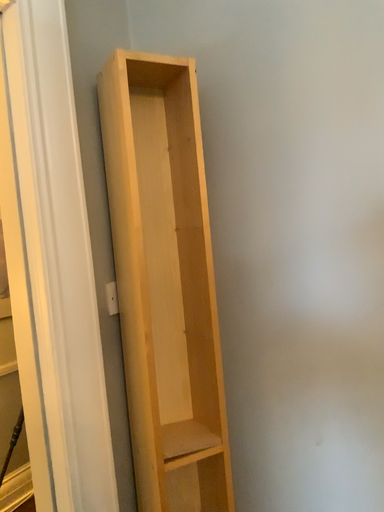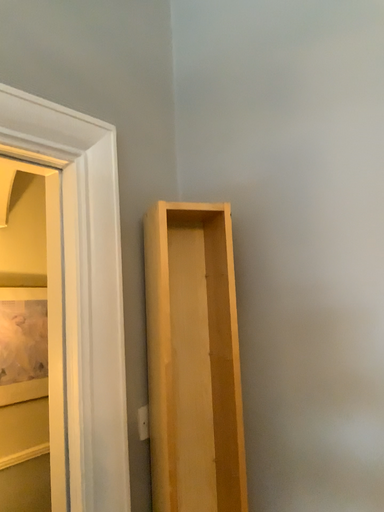
Question: Which way did the camera rotate in the video?

Choices:
 (A) rotated upward
 (B) rotated downward

Answer: (A)